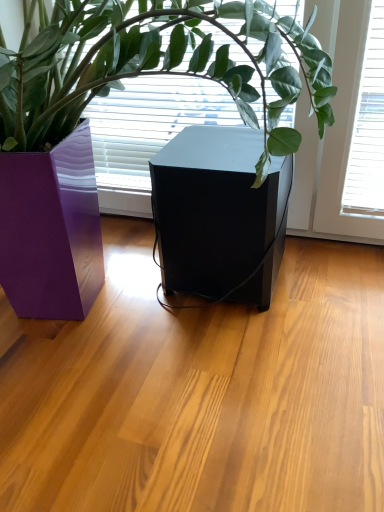
This screenshot has width=384, height=512. What are the coordinates of `free spot in front of black matte speaker at center` in the screenshot? It's located at (237, 353).